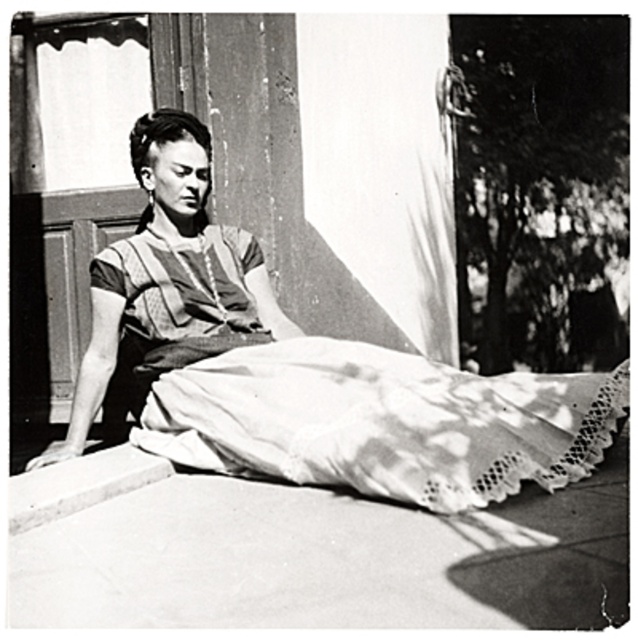
You are standing in front of the wooden structure in the image. There are two points marked on the image. The first point is at coordinates point (239, 420) and the second is at point (41, 488). Which point is closer to you?

Point (41, 488) is closer to you because it is in front of point (239, 420) according to their spatial arrangement.

You are standing in front of the wooden structure in the image. You notice the matte fabric dress at center and the smooth concrete curb at lower left. Which object is positioned to the right of the other?

The matte fabric dress at center is to the right of the smooth concrete curb at lower left.

Based on the scene described, can you determine the spatial relationship between the matte fabric dress at center and the smooth concrete curb at lower left?

The matte fabric dress at center is above the smooth concrete curb at lower left, indicating it is positioned higher up in the image.